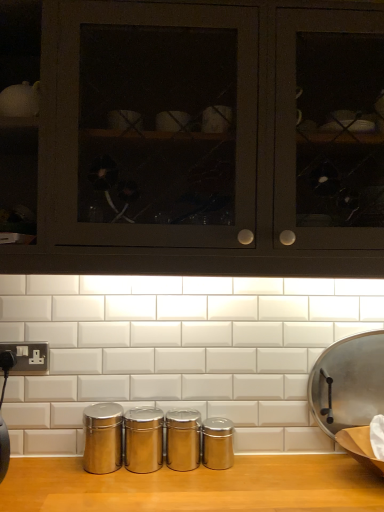
Question: Can you confirm if silver metallic plug socket at lower left is shorter than matte black cabinets at upper center?

Choices:
 (A) yes
 (B) no

Answer: (A)

Question: Does silver metallic plug socket at lower left have a greater width compared to matte black cabinets at upper center?

Choices:
 (A) yes
 (B) no

Answer: (B)

Question: Is silver metallic plug socket at lower left not within matte black cabinets at upper center?

Choices:
 (A) yes
 (B) no

Answer: (A)

Question: Is silver metallic plug socket at lower left to the left of matte black cabinets at upper center from the viewer's perspective?

Choices:
 (A) yes
 (B) no

Answer: (A)

Question: Does silver metallic plug socket at lower left turn towards matte black cabinets at upper center?

Choices:
 (A) no
 (B) yes

Answer: (A)

Question: Is point (21, 347) positioned closer to the camera than point (347, 362)?

Choices:
 (A) farther
 (B) closer

Answer: (B)

Question: Considering their positions, is silver metallic plug socket at lower left located in front of or behind metallic silver frying pan at right?

Choices:
 (A) front
 (B) behind

Answer: (B)

Question: Based on their sizes in the image, would you say silver metallic plug socket at lower left is bigger or smaller than metallic silver frying pan at right?

Choices:
 (A) small
 (B) big

Answer: (A)

Question: Choose the correct answer: Is silver metallic plug socket at lower left inside metallic silver frying pan at right or outside it?

Choices:
 (A) inside
 (B) outside

Answer: (B)

Question: Is silver metallic plug socket at lower left taller or shorter than matte black cabinets at upper center?

Choices:
 (A) tall
 (B) short

Answer: (B)

Question: Which is correct: silver metallic plug socket at lower left is inside matte black cabinets at upper center, or outside of it?

Choices:
 (A) inside
 (B) outside

Answer: (B)

Question: Is silver metallic plug socket at lower left to the left or to the right of matte black cabinets at upper center in the image?

Choices:
 (A) left
 (B) right

Answer: (A)

Question: Considering their positions, is silver metallic plug socket at lower left located in front of or behind matte black cabinets at upper center?

Choices:
 (A) front
 (B) behind

Answer: (B)

Question: From a real-world perspective, relative to silver metallic plug socket at lower left, is matte black cabinets at upper center vertically above or below?

Choices:
 (A) below
 (B) above

Answer: (B)

Question: Is matte black cabinets at upper center wider or thinner than silver metallic plug socket at lower left?

Choices:
 (A) wide
 (B) thin

Answer: (A)